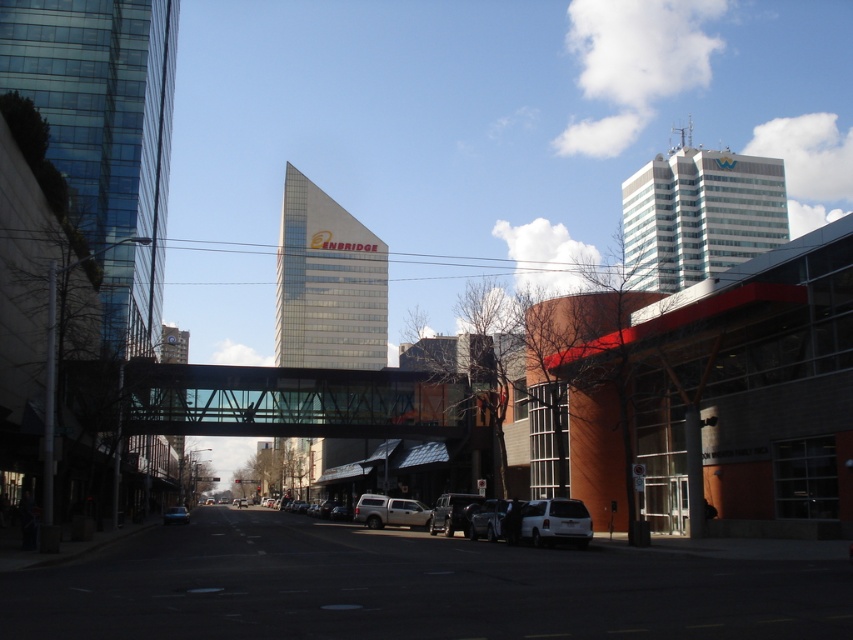
Question: Is transparent glass bridge at center closer to the viewer compared to metallic silver suv at center?

Choices:
 (A) no
 (B) yes

Answer: (B)

Question: In this image, where is metallic silver suv at center located relative to matte black car at center?

Choices:
 (A) right
 (B) left

Answer: (A)

Question: Which point is farther from the camera taking this photo?

Choices:
 (A) (287, 424)
 (B) (180, 506)
 (C) (506, 502)

Answer: (B)

Question: Which object is farther from the camera taking this photo?

Choices:
 (A) metallic silver suv at center
 (B) white matte suv at lower center

Answer: (A)

Question: Considering the relative positions of transparent glass bridge at center and silver metallic truck at center in the image provided, where is transparent glass bridge at center located with respect to silver metallic truck at center?

Choices:
 (A) left
 (B) right

Answer: (A)

Question: Which object is closer to the camera taking this photo?

Choices:
 (A) transparent glass bridge at center
 (B) white matte suv at lower center
 (C) metallic silver car at center
 (D) matte black car at center

Answer: (B)